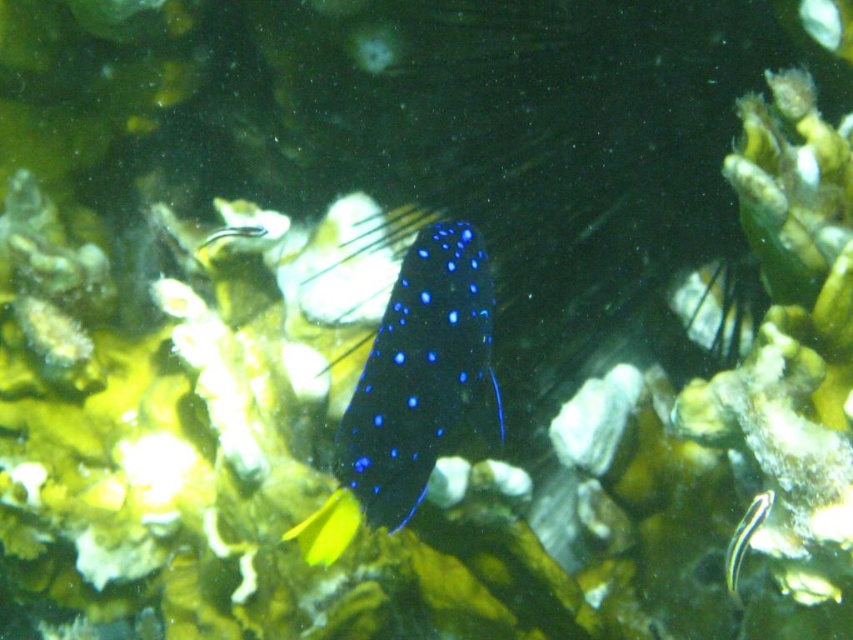
You are a marine biologist observing the underwater scene. You notice the glossy blue fish at center and the black glossy stripe at lower right. Which object is taller in the image?

The glossy blue fish at center is taller than the black glossy stripe at lower right according to the description.

From the picture: You are a marine biologist observing the underwater scene. You notice two points marked in the image. Which point is closer to you, point (497, 385) or point (738, 570)?

Point (497, 385) is further to the viewer than point (738, 570), so point (738, 570) is closer to you.

You are a marine biologist observing an underwater scene. You notice a glossy blue fish at center and a black glossy stripe at lower right. Which object is located above the other?

The glossy blue fish at center is positioned over the black glossy stripe at lower right, meaning it is above the stripe.